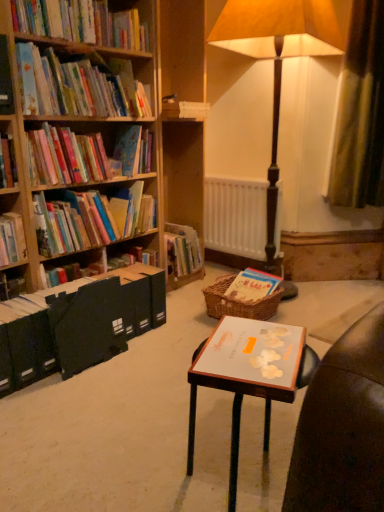
Question: Considering the relative sizes of matte paper book at left, the third book when ordered from bottom to top, and white matte book at center, which is the second paperback book in left-to-right order, in the image provided, is matte paper book at left, the third book when ordered from bottom to top, wider than white matte book at center, which is the second paperback book in left-to-right order,?

Choices:
 (A) no
 (B) yes

Answer: (A)

Question: Is matte paper book at left, the third book when ordered from bottom to top, further to the viewer compared to white matte book at center, which is counted as the 1th paperback book, starting from the right?

Choices:
 (A) yes
 (B) no

Answer: (A)

Question: Is matte paper book at left, the third book when ordered from bottom to top, oriented towards white matte book at center, which appears as the second paperback book when viewed from the back?

Choices:
 (A) yes
 (B) no

Answer: (B)

Question: Is matte paper book at left, which is the third book from top to bottom, oriented away from white matte book at center, which appears as the second paperback book when viewed from the back?

Choices:
 (A) yes
 (B) no

Answer: (B)

Question: Can you confirm if matte paper book at left, the third book when ordered from bottom to top, is thinner than white matte book at center, the 1th paperback book from the front?

Choices:
 (A) no
 (B) yes

Answer: (B)

Question: Can we say matte paper book at left, which is the third book from top to bottom, lies outside white matte book at center, which appears as the second paperback book when viewed from the back?

Choices:
 (A) yes
 (B) no

Answer: (A)

Question: From a real-world perspective, is hardcover books at upper left, positioned as the first book in top-to-bottom order, on top of matte paper bookshelf at upper left, which is counted as the 2th book, starting from the top?

Choices:
 (A) no
 (B) yes

Answer: (B)

Question: Is hardcover books at upper left, positioned as the first book in top-to-bottom order, closer to the viewer compared to matte paper bookshelf at upper left, the 4th book from the bottom?

Choices:
 (A) no
 (B) yes

Answer: (B)

Question: Is hardcover books at upper left, positioned as the first book in top-to-bottom order, at the left side of matte paper bookshelf at upper left, the 4th book from the bottom?

Choices:
 (A) no
 (B) yes

Answer: (B)

Question: Can you confirm if hardcover books at upper left, positioned as the first book in top-to-bottom order, is wider than matte paper bookshelf at upper left, which is counted as the 2th book, starting from the top?

Choices:
 (A) yes
 (B) no

Answer: (B)

Question: Does hardcover books at upper left, positioned as the first book in top-to-bottom order, turn towards matte paper bookshelf at upper left, the 4th book from the bottom?

Choices:
 (A) no
 (B) yes

Answer: (A)

Question: Is there a large distance between hardcover books at upper left, positioned as the first book in top-to-bottom order, and matte paper bookshelf at upper left, which is counted as the 2th book, starting from the top?

Choices:
 (A) no
 (B) yes

Answer: (A)

Question: From a real-world perspective, is matte paper bookshelf at upper left, which is counted as the 2th book, starting from the top, located beneath brown woven picnic basket at center?

Choices:
 (A) no
 (B) yes

Answer: (A)